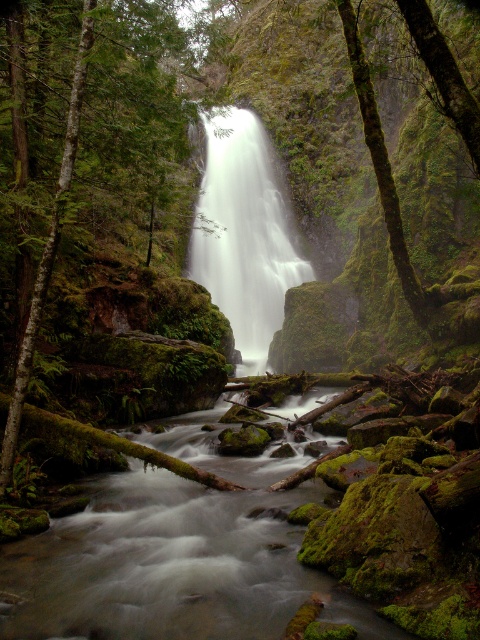
Question: Can you confirm if white smooth waterfall at center is positioned above green mossy tree at left?

Choices:
 (A) yes
 (B) no

Answer: (A)

Question: Among these points, which one is farthest from the camera?

Choices:
 (A) (239, 342)
 (B) (46, 264)

Answer: (A)

Question: Does white smooth waterfall at center have a larger size compared to green mossy tree at left?

Choices:
 (A) yes
 (B) no

Answer: (A)

Question: Is white smooth waterfall at center above green mossy tree at left?

Choices:
 (A) no
 (B) yes

Answer: (B)

Question: Which object is farther from the camera taking this photo?

Choices:
 (A) green mossy tree at left
 (B) white smooth waterfall at center

Answer: (B)